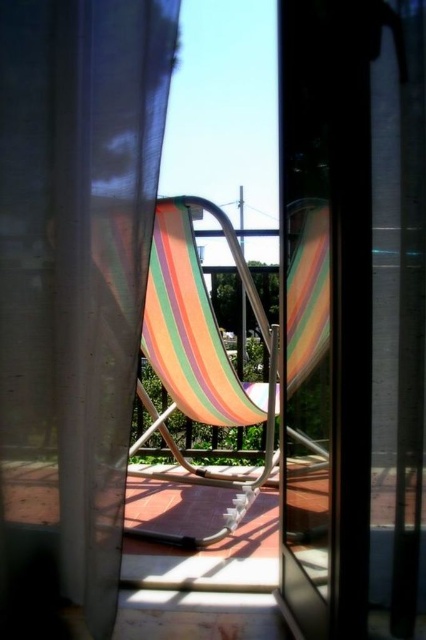
Question: Does multicolored fabric beach chair at center have a larger size compared to translucent plastic screen door at center?

Choices:
 (A) no
 (B) yes

Answer: (B)

Question: Based on their relative distances, which object is farther from the sheer white curtain at center?

Choices:
 (A) translucent plastic screen door at center
 (B) multicolored fabric beach chair at center

Answer: (B)

Question: Does sheer white curtain at center come in front of multicolored fabric beach chair at center?

Choices:
 (A) no
 (B) yes

Answer: (B)

Question: Is sheer white curtain at center thinner than multicolored fabric beach chair at center?

Choices:
 (A) yes
 (B) no

Answer: (A)

Question: Which point is closer to the camera?

Choices:
 (A) (203, 358)
 (B) (324, 540)
 (C) (9, 600)

Answer: (B)

Question: Which of the following is the closest to the observer?

Choices:
 (A) sheer white curtain at center
 (B) multicolored fabric beach chair at center
 (C) translucent plastic screen door at center

Answer: (A)